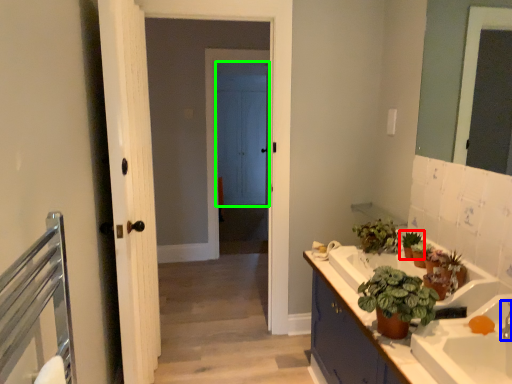
Question: Considering the real-world distances, which object is farthest from houseplant (highlighted by a red box)? faucet (highlighted by a blue box) or door (highlighted by a green box)?

Choices:
 (A) faucet
 (B) door

Answer: (B)